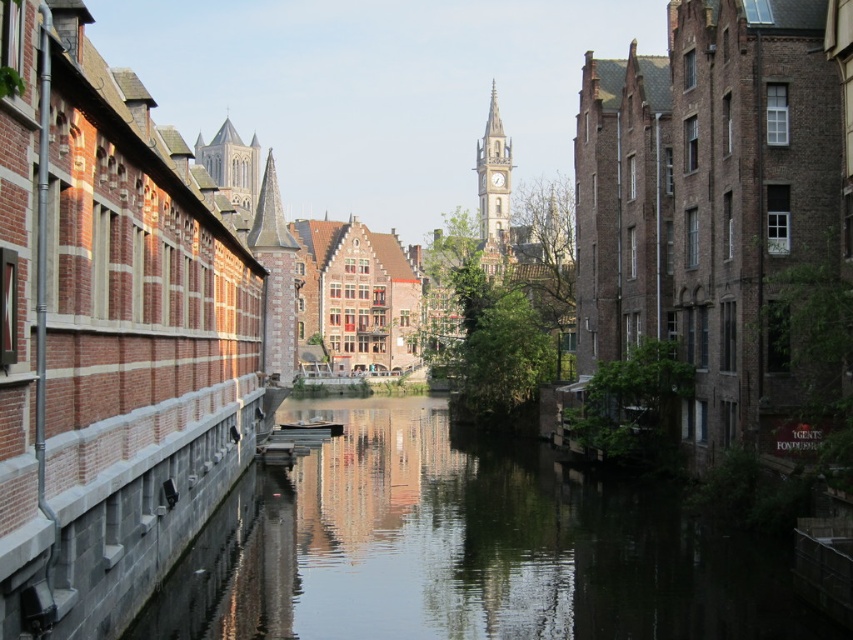
Between stone clock tower at center and smooth stone tower at upper center, which one is positioned lower?

smooth stone tower at upper center

What do you see at coordinates (492, 182) in the screenshot? I see `stone clock tower at center` at bounding box center [492, 182].

Identify the location of stone clock tower at center. (492, 182).

Based on the photo, who is more forward, (468,496) or (479,170)?

Point (468,496) is more forward.

Who is more forward, (283, 612) or (498, 216)?

Point (283, 612) is in front.

This screenshot has width=853, height=640. What are the coordinates of `smooth concrete water at center` in the screenshot? It's located at (463, 547).

Does smooth concrete water at center appear under smooth stone tower at upper center?

Yes.

From the picture: Is smooth concrete water at center bigger than smooth stone tower at upper center?

No.

Is point (564, 532) behind point (225, 170)?

No, (564, 532) is closer to viewer.

In order to click on smooth concrete water at center in this screenshot , I will do `click(463, 547)`.